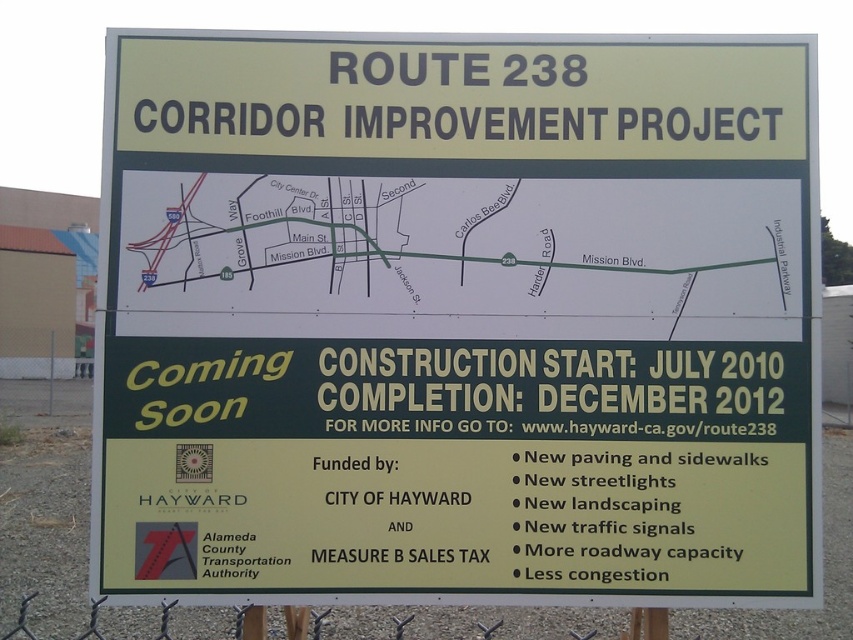
Question: Which point appears farthest from the camera in this image?

Choices:
 (A) (160, 609)
 (B) (33, 388)

Answer: (B)

Question: Is metal wire fence at lower center positioned at the back of metallic chain-link fence at lower left?

Choices:
 (A) yes
 (B) no

Answer: (B)

Question: Which object appears farthest from the camera in this image?

Choices:
 (A) metallic chain-link fence at lower left
 (B) metal wire fence at lower center

Answer: (A)

Question: Does metal wire fence at lower center have a smaller size compared to metallic chain-link fence at lower left?

Choices:
 (A) yes
 (B) no

Answer: (A)

Question: Is metal wire fence at lower center smaller than metallic chain-link fence at lower left?

Choices:
 (A) no
 (B) yes

Answer: (B)